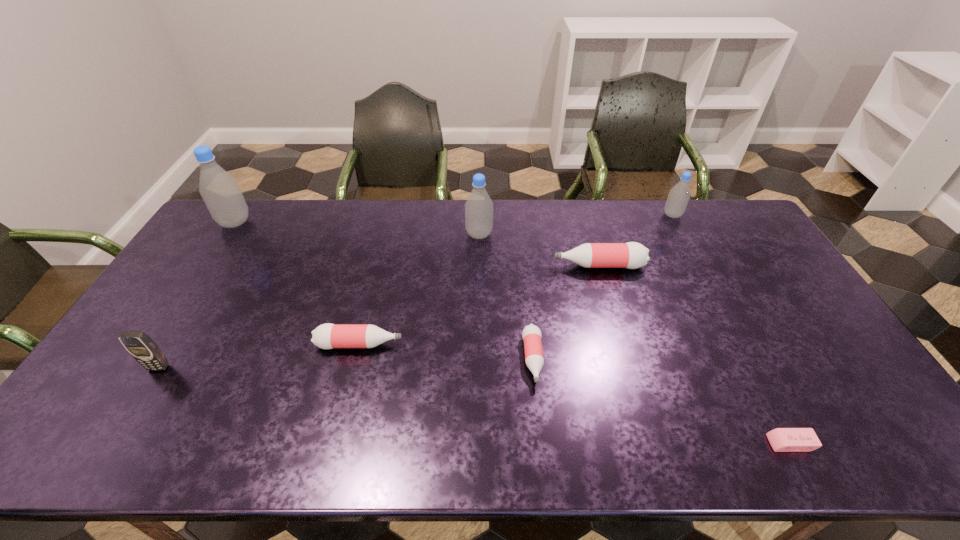
Identify the location of vacant region at the near edge of the desktop. (749, 437).

The image size is (960, 540). I want to click on free space at the right edge, so click(x=854, y=418).

The image size is (960, 540). Identify the location of vacant space at the near left corner of the desktop. (94, 438).

Where is `free space at the far right corner of the desktop`? The height and width of the screenshot is (540, 960). free space at the far right corner of the desktop is located at coordinates (708, 227).

Where is `free space between the tallest bottle and the seventh tallest object`? free space between the tallest bottle and the seventh tallest object is located at coordinates (384, 291).

Find the location of a particular element. This screenshot has width=960, height=540. vacant area between the third tallest object and the cellular telephone is located at coordinates (416, 291).

This screenshot has width=960, height=540. What are the coordinates of `vacant point located between the second smallest pink bottle and the rightmost gray bottle` in the screenshot? It's located at (516, 280).

This screenshot has width=960, height=540. Identify the location of free point between the farthest pink bottle and the smallest pink bottle. (565, 312).

Where is `empty location between the fourth shortest bottle and the pink eraser`? empty location between the fourth shortest bottle and the pink eraser is located at coordinates (732, 329).

I want to click on unoccupied position between the fourth object from left to right and the tallest bottle, so click(x=357, y=228).